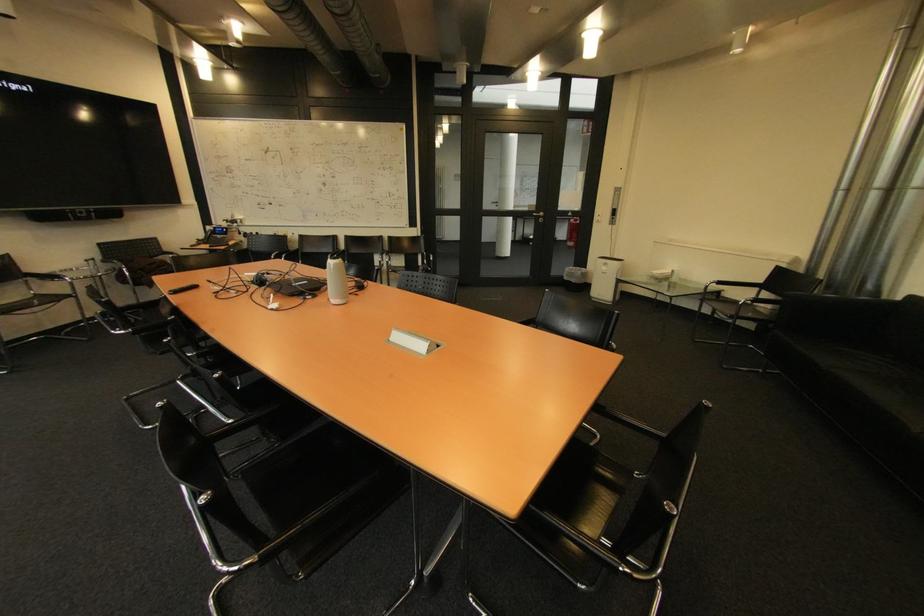
Where would you pull the metal door handle? Please return your answer as a coordinate pair (x, y).

(537, 213)